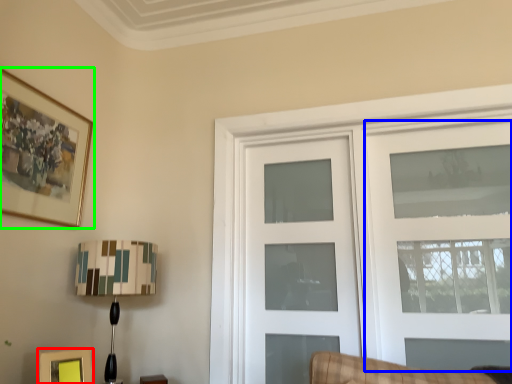
Question: Estimate the real-world distances between objects in this image. Which object is farther from picture frame (highlighted by a red box), door (highlighted by a blue box) or picture frame (highlighted by a green box)?

Choices:
 (A) door
 (B) picture frame

Answer: (A)